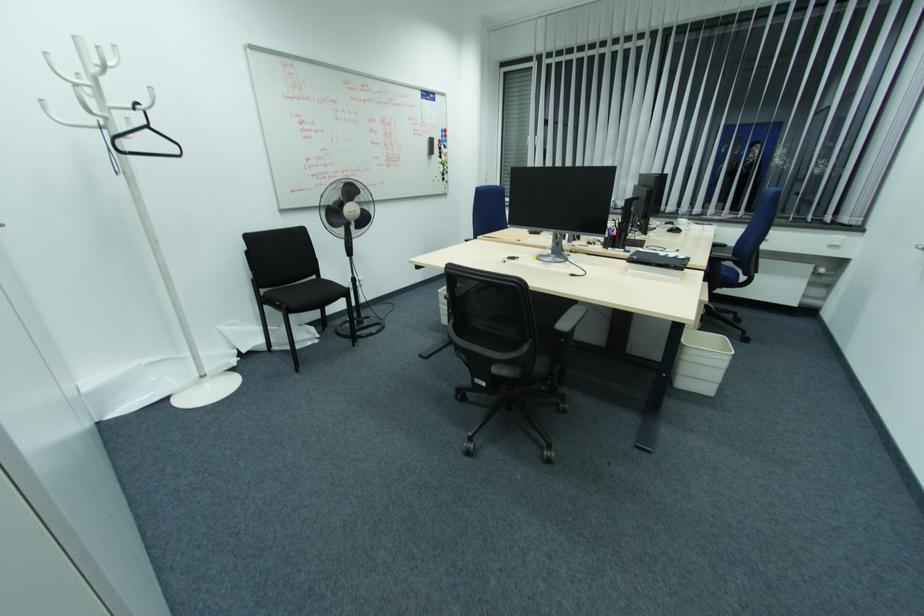
Where would you sit the blue chair sitting surface? Please return your answer as a coordinate pair (x, y).

(728, 276)